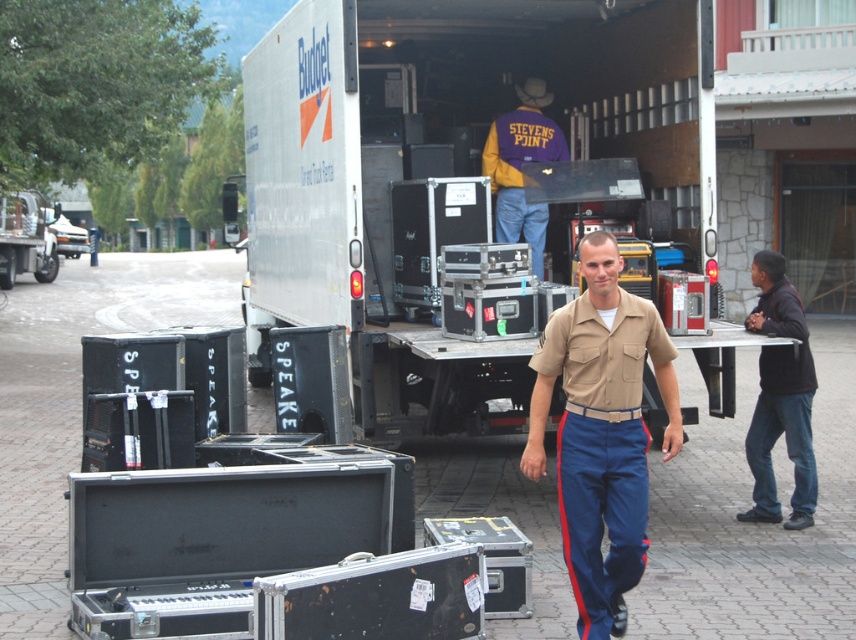
You are standing in front of the Budget rental truck and want to locate the black matte jacket at right. Where should you look relative to the truck?

The black matte jacket at right is located at point 0.622 on the x axis and 0.912 on the y axis relative to the truck.

You are standing at the point marked as point (601,432) in the image. What object is located exactly at this point?

The point (601,432) corresponds to the khaki uniform at center.